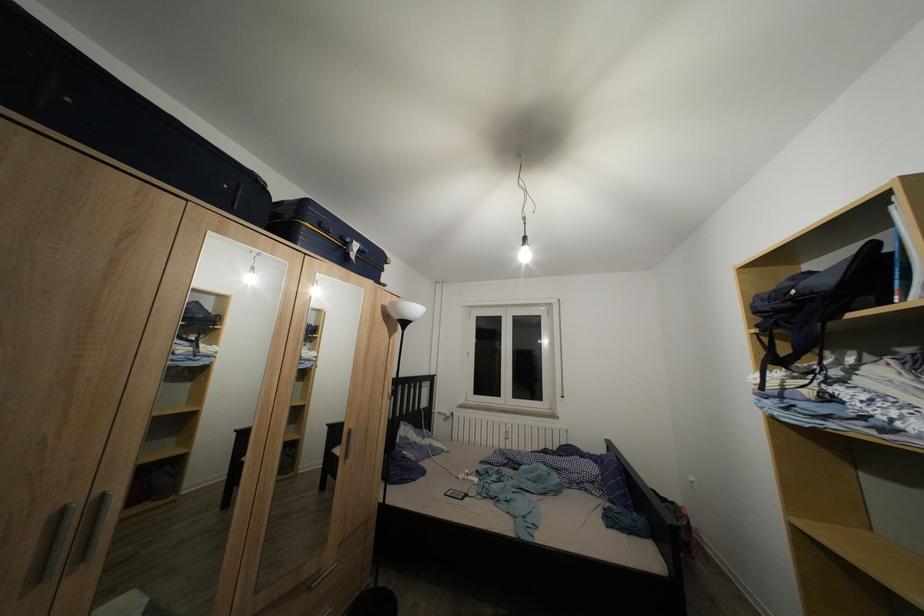
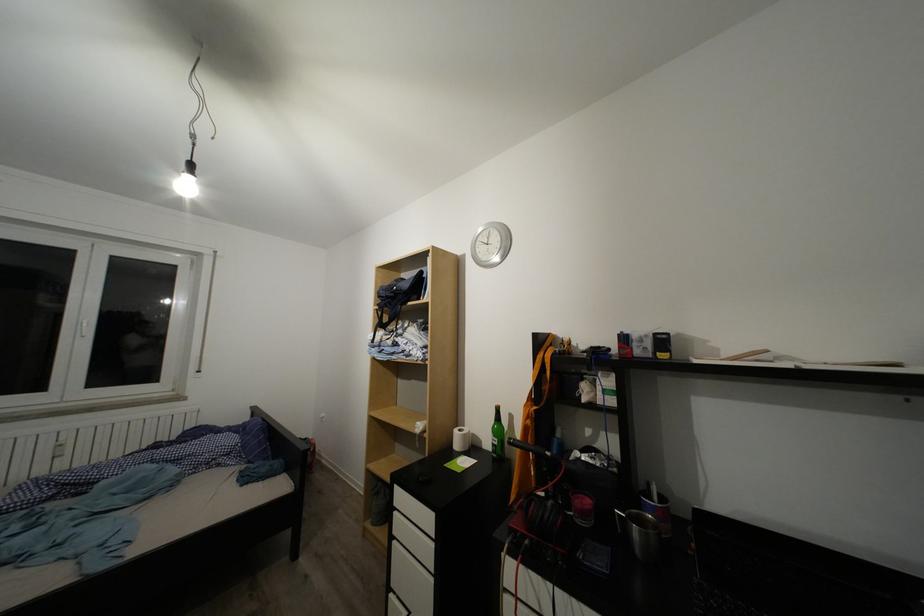
In the second image, find the point that corresponds to point (532, 262) in the first image.

(193, 195)